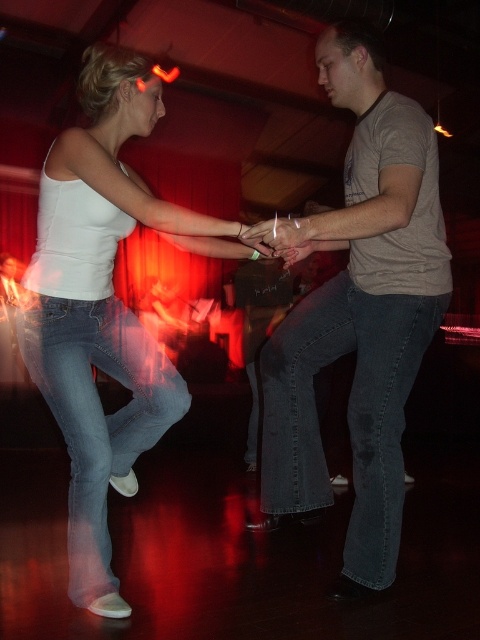
You are a photographer at the event and want to capture a closeup of the white matte tank top at upper left and the blue denim jeans at center. Which object should you focus on first to ensure it appears sharp in the photo?

The white matte tank top at upper left is closer to the viewer than the blue denim jeans at center, so you should focus on the white matte tank top at upper left first to ensure it appears sharp.

You are a photographer at the event and want to capture a closeup shot of the blue denim jeans at center and the matte skin hand at center. Your camera has a minimum focus distance of 20 inches. Will you be able to take the photo without moving the camera closer?

The distance between the blue denim jeans at center and the matte skin hand at center is 23.22 inches, which is greater than the camera minimum focus distance of 20 inches. Therefore, the photographer can take the photo without moving the camera closer.